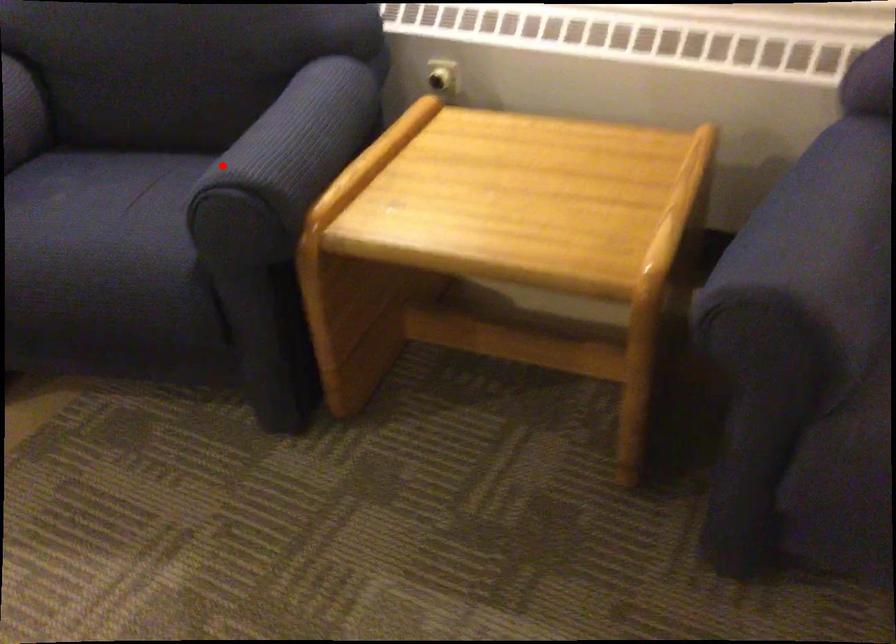
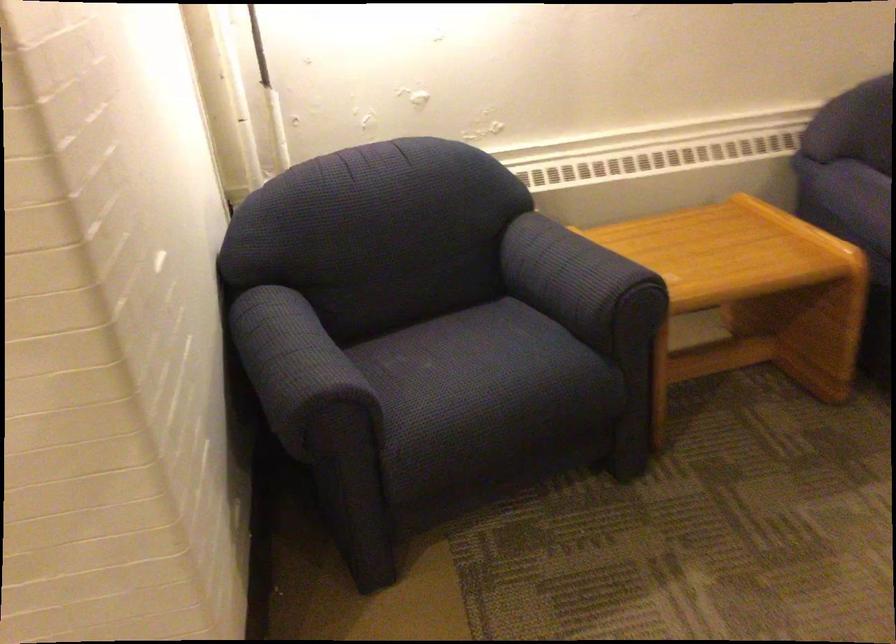
Question: I am providing you with two images of the same scene from different viewpoints. A red point is marked on the first image. Is the red point's position out of view in image 2?

Choices:
 (A) Yes
 (B) No

Answer: (B)